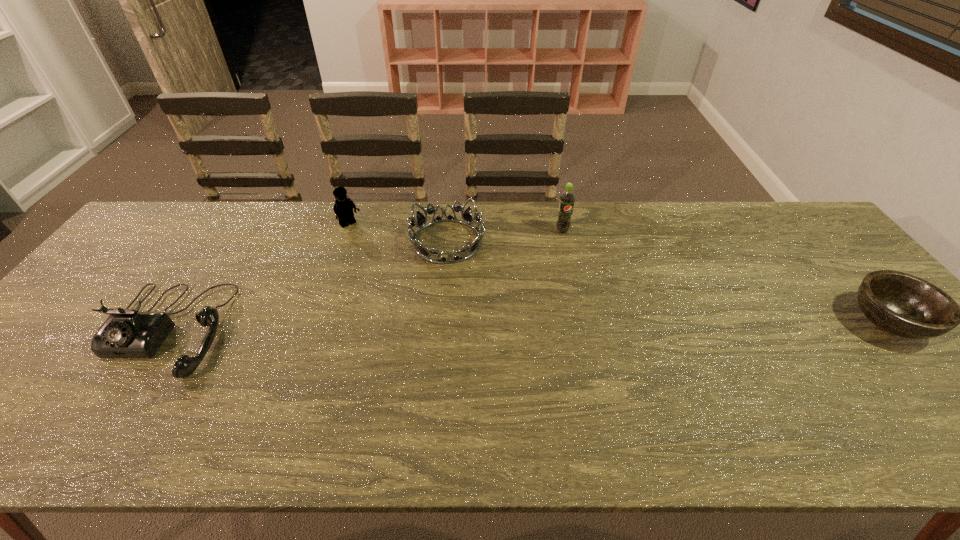
Image resolution: width=960 pixels, height=540 pixels. I want to click on vacant space on the desktop that is between the leftmost object and the bowl and is positioned on the front-facing side of the third object from left to right, so click(617, 325).

Image resolution: width=960 pixels, height=540 pixels. I want to click on vacant space on the desktop that is between the telephone and the rightmost object and is positioned on the front label of the fourth object from left to right, so click(602, 325).

Find the location of a particular element. vacant space on the desktop that is between the leftmost object and the bowl and is positioned on the front-facing side of the Lego is located at coordinates (445, 327).